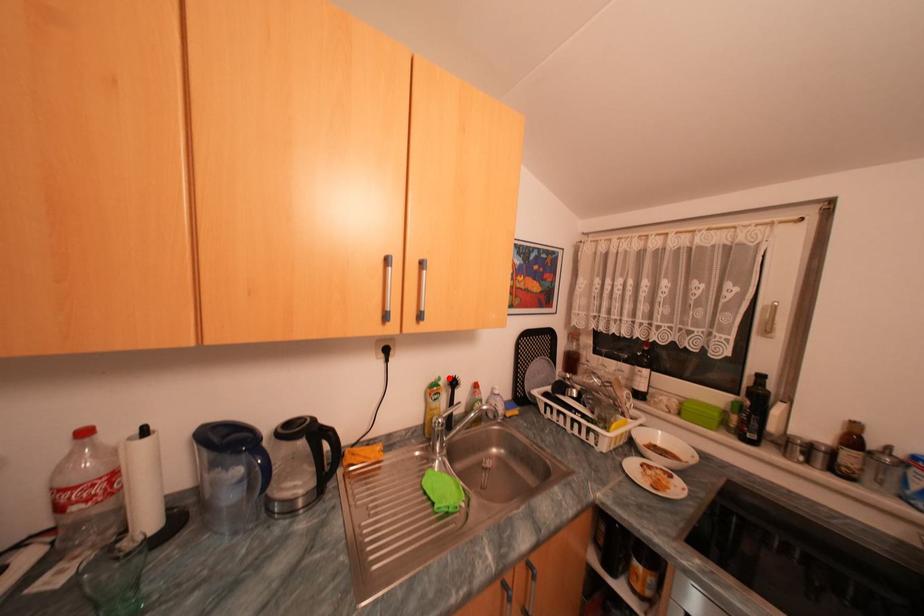
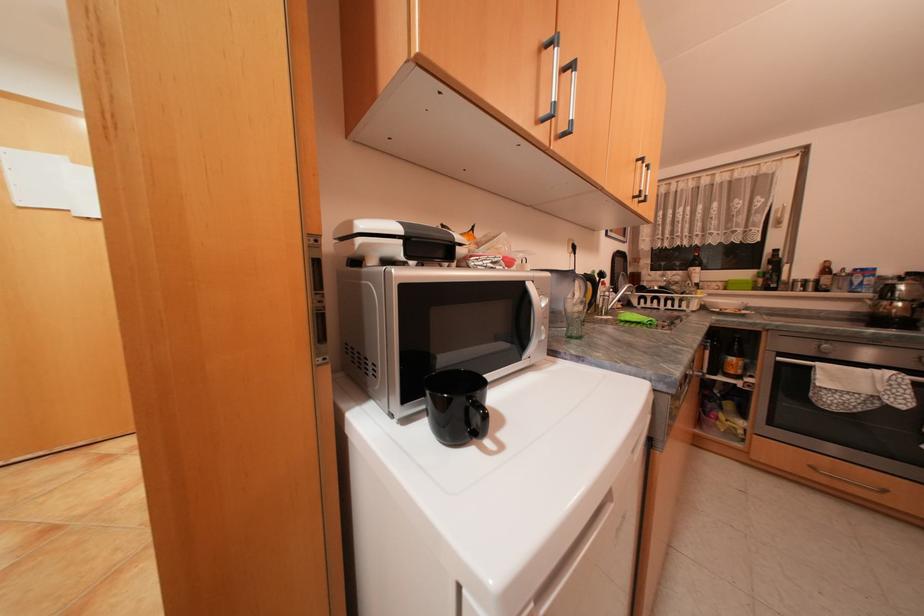
Locate, in the second image, the point that corresponds to the highlighted location in the first image.

(602, 270)